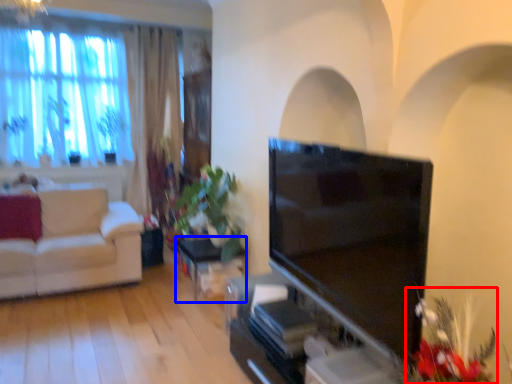
Question: Among these objects, which one is nearest to the camera, floral arrangement (highlighted by a red box) or table (highlighted by a blue box)?

Choices:
 (A) floral arrangement
 (B) table

Answer: (A)